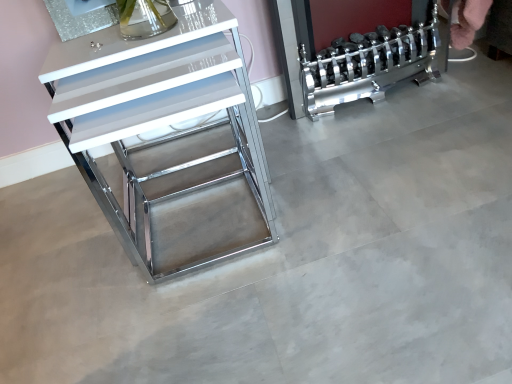
Question: Does chrome metallic dumbbell rack at right have a greater height compared to white glossy drawer at left?

Choices:
 (A) no
 (B) yes

Answer: (A)

Question: Is chrome metallic dumbbell rack at right aimed at white glossy drawer at left?

Choices:
 (A) no
 (B) yes

Answer: (A)

Question: From the image's perspective, is chrome metallic dumbbell rack at right under white glossy drawer at left?

Choices:
 (A) yes
 (B) no

Answer: (B)

Question: Considering the relative sizes of chrome metallic dumbbell rack at right and white glossy drawer at left in the image provided, is chrome metallic dumbbell rack at right wider than white glossy drawer at left?

Choices:
 (A) no
 (B) yes

Answer: (A)

Question: Is the depth of chrome metallic dumbbell rack at right greater than that of white glossy drawer at left?

Choices:
 (A) no
 (B) yes

Answer: (B)

Question: Can you confirm if chrome metallic dumbbell rack at right is thinner than white glossy drawer at left?

Choices:
 (A) yes
 (B) no

Answer: (A)

Question: Does white glossy drawer at left have a greater height compared to chrome metallic dumbbell rack at right?

Choices:
 (A) yes
 (B) no

Answer: (A)

Question: From the image's perspective, does white glossy drawer at left appear lower than chrome metallic dumbbell rack at right?

Choices:
 (A) no
 (B) yes

Answer: (B)

Question: From a real-world perspective, is white glossy drawer at left below chrome metallic dumbbell rack at right?

Choices:
 (A) no
 (B) yes

Answer: (A)

Question: Considering the relative positions of white glossy drawer at left and chrome metallic dumbbell rack at right in the image provided, is white glossy drawer at left behind chrome metallic dumbbell rack at right?

Choices:
 (A) yes
 (B) no

Answer: (B)

Question: Considering the relative positions of white glossy drawer at left and chrome metallic dumbbell rack at right in the image provided, is white glossy drawer at left to the right of chrome metallic dumbbell rack at right from the viewer's perspective?

Choices:
 (A) yes
 (B) no

Answer: (B)

Question: Can you confirm if white glossy drawer at left is thinner than chrome metallic dumbbell rack at right?

Choices:
 (A) yes
 (B) no

Answer: (B)

Question: Based on their sizes in the image, would you say white glossy drawer at left is bigger or smaller than chrome metallic dumbbell rack at right?

Choices:
 (A) big
 (B) small

Answer: (A)